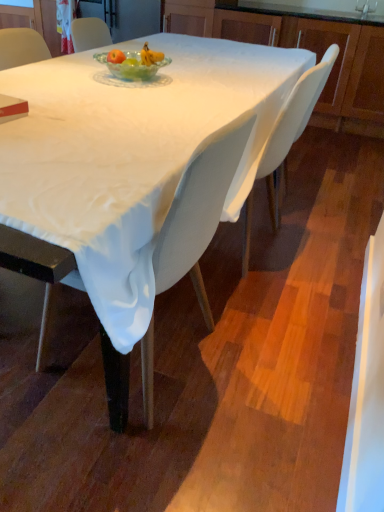
Find the location of `vacant area located to the right-hand side of translucent glass bowl at center`. vacant area located to the right-hand side of translucent glass bowl at center is located at coordinates (197, 82).